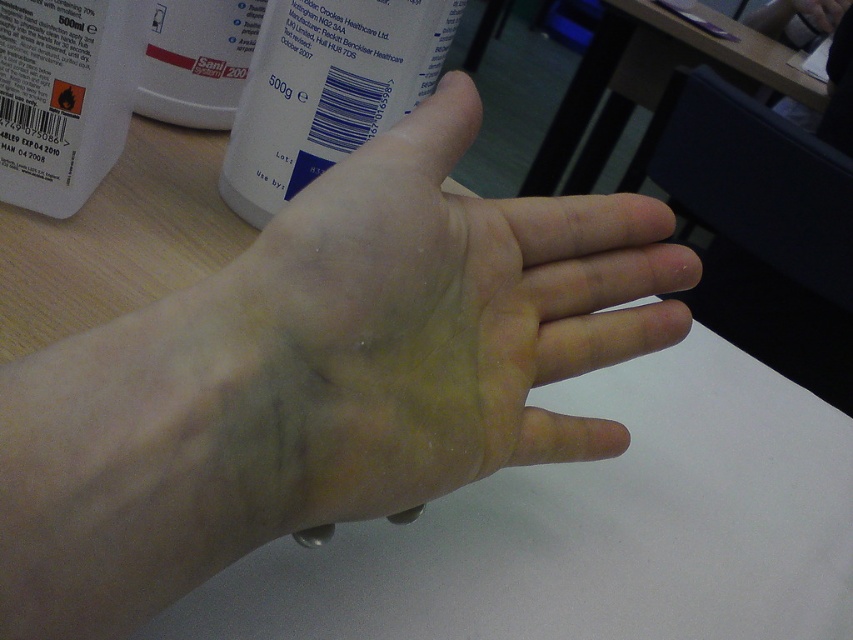
You are a healthcare professional examining a patient. You notice the pale skin hand at center and the white plastic bottle at upper center in the scene. Based on their positions, which object is closer to you?

The pale skin hand at center is closer to you than the white plastic bottle at upper center because the hand is positioned palm up and the fingers are spread, while the bottle is at upper center, typically indicating it is behind the hand.

You are a healthcare professional examining a patient. You notice the pale skin hand at center and the white plastic bottle at upper center in the scene. Based on their relative sizes, which object would you estimate is closer to you?

The pale skin hand at center is much taller than the white plastic bottle at upper center, so it is closer to you.

You are a healthcare professional examining a patient. You notice the pale skin hand at center and the white plastic bottle at upper center. Which object is bigger in size?

The pale skin hand at center is larger in size than the white plastic bottle at upper center.